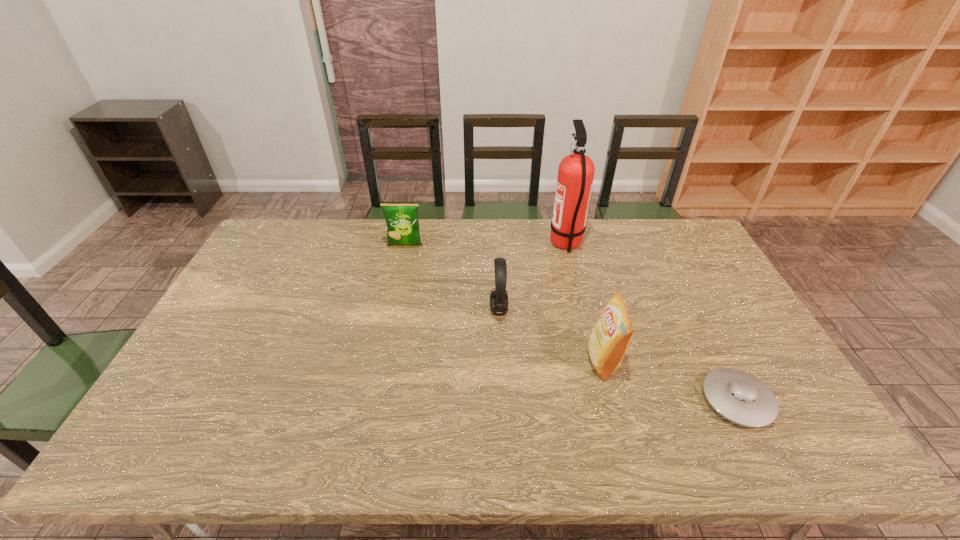
At what (x,y) coordinates should I click in order to perform the action: click on free spot located 0.230m on the handle side of the fire extinguisher. Please return your answer as a coordinate pair (x, y). The image size is (960, 540). Looking at the image, I should click on (486, 244).

Where is `free point located on the front-facing side of the nearer crisp (potato chip)`? This screenshot has height=540, width=960. free point located on the front-facing side of the nearer crisp (potato chip) is located at coordinates (x=533, y=360).

Identify the location of vacant area situated 0.160m on the front-facing side of the nearer crisp (potato chip). pos(529,360).

Where is `free space located on the front-facing side of the nearer crisp (potato chip)`? free space located on the front-facing side of the nearer crisp (potato chip) is located at coordinates (521, 360).

I want to click on vacant position located on the front-facing side of the leftmost object, so click(x=388, y=328).

The width and height of the screenshot is (960, 540). I want to click on vacant space located 0.110m on the front-facing side of the headset, so click(x=454, y=309).

Find the location of `vacant space located 0.400m on the front-facing side of the headset`. vacant space located 0.400m on the front-facing side of the headset is located at coordinates (359, 309).

I want to click on vacant area situated 0.110m on the front-facing side of the headset, so click(454, 309).

This screenshot has height=540, width=960. What are the coordinates of `vacant space located 0.100m on the back of the saucer` in the screenshot? It's located at (708, 344).

Identify the location of fire extinguisher at the far edge. The image size is (960, 540). (576, 171).